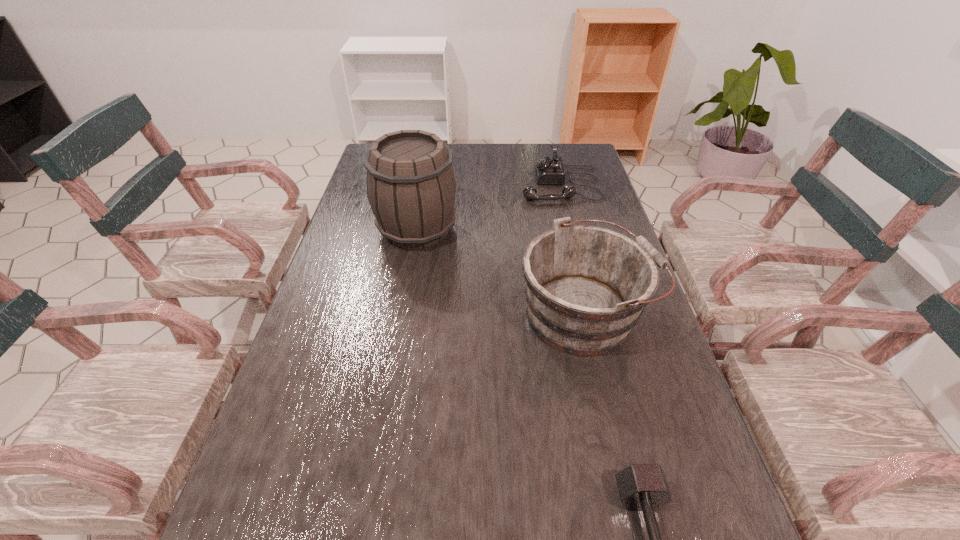
Where is `the taller wine bucket`? Image resolution: width=960 pixels, height=540 pixels. the taller wine bucket is located at coordinates (411, 187).

Locate an element on the screen. the farther wine bucket is located at coordinates (411, 187).

The height and width of the screenshot is (540, 960). I want to click on the right wine bucket, so click(x=586, y=287).

The height and width of the screenshot is (540, 960). Find the location of `the second tallest object`. the second tallest object is located at coordinates (586, 287).

Locate an element on the screen. telephone is located at coordinates (548, 170).

Find the location of a particular element. the third tallest object is located at coordinates (548, 170).

Locate an element on the screen. The height and width of the screenshot is (540, 960). free space located on the front of the tallest object is located at coordinates (407, 286).

The image size is (960, 540). I want to click on vacant area located on the left of the third shortest object, so click(436, 313).

You are a GUI agent. You are given a task and a screenshot of the screen. Output one action in this format:
    pyautogui.click(x=<x>, y=<y>)
    Task: Click on the vacant region located 0.160m on the dial of the farthest object
    
    Given the screenshot: What is the action you would take?
    pyautogui.click(x=473, y=184)

I want to click on free space located 0.050m on the dial of the farthest object, so click(x=505, y=184).